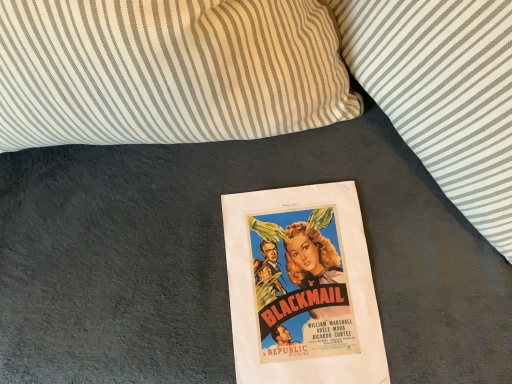
Question: In the image, is white striped pillow at upper center, the 2th pillow viewed from the right, positioned in front of or behind striped fabric pillow at upper center, the 1th pillow from the right?

Choices:
 (A) behind
 (B) front

Answer: (A)

Question: Is white striped pillow at upper center, which is the 1th pillow from left to right, inside the boundaries of striped fabric pillow at upper center, arranged as the 2th pillow when viewed from the left, or outside?

Choices:
 (A) inside
 (B) outside

Answer: (B)

Question: From the image's perspective, is white striped pillow at upper center, which is the 1th pillow from left to right, positioned above or below striped fabric pillow at upper center, arranged as the 2th pillow when viewed from the left?

Choices:
 (A) below
 (B) above

Answer: (B)

Question: Looking at their shapes, would you say striped fabric pillow at upper center, arranged as the 2th pillow when viewed from the left, is wider or thinner than white striped pillow at upper center, the 2th pillow viewed from the right?

Choices:
 (A) thin
 (B) wide

Answer: (B)

Question: Is striped fabric pillow at upper center, the 1th pillow from the right, to the left or to the right of white striped pillow at upper center, the 2th pillow viewed from the right, in the image?

Choices:
 (A) left
 (B) right

Answer: (B)

Question: Looking at the image, does striped fabric pillow at upper center, the 1th pillow from the right, seem bigger or smaller compared to white striped pillow at upper center, the 2th pillow viewed from the right?

Choices:
 (A) big
 (B) small

Answer: (B)

Question: Considering their positions, is striped fabric pillow at upper center, the 1th pillow from the right, located in front of or behind white striped pillow at upper center, the 2th pillow viewed from the right?

Choices:
 (A) front
 (B) behind

Answer: (A)